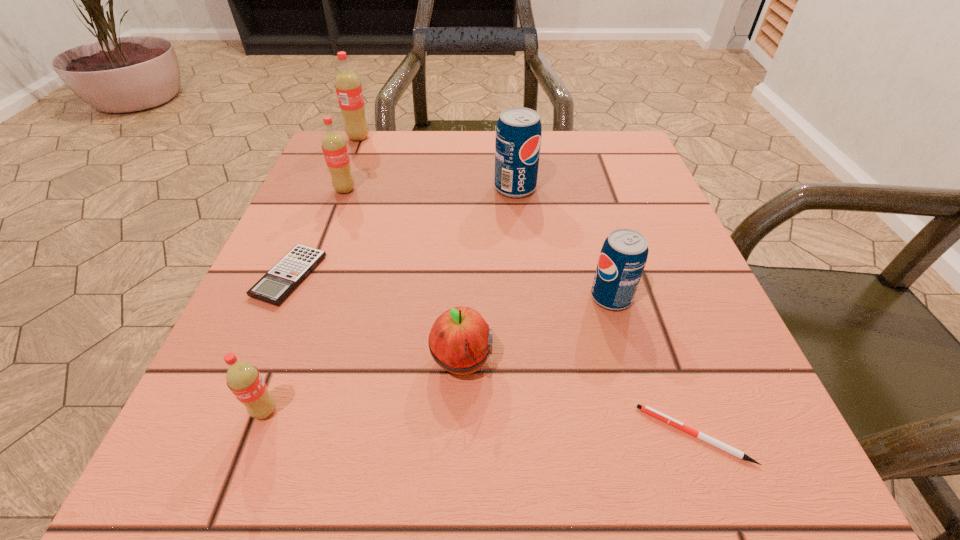
You are a GUI agent. You are given a task and a screenshot of the screen. Output one action in this format:
    pyautogui.click(x=<x>, y=<y>)
    Task: Click on the free space at the near edge of the desktop
    The image size is (960, 540).
    Given the screenshot: What is the action you would take?
    pyautogui.click(x=371, y=465)

Identify the location of vacant space at the left edge of the desktop. The image size is (960, 540). (289, 349).

Identify the location of free space at the right edge. 699,360.

At what (x,y) coordinates should I click in order to perform the action: click on vacant space at the far left corner of the desktop. Please return your answer as a coordinate pair (x, y). The image size is (960, 540). Looking at the image, I should click on [x=349, y=151].

Image resolution: width=960 pixels, height=540 pixels. In the image, there is a desktop. Identify the location of free space at the near left corner. (271, 502).

Find the location of a particular element. The image size is (960, 540). free region at the far right corner of the desktop is located at coordinates (592, 163).

The image size is (960, 540). I want to click on unoccupied area between the calculator and the third shortest object, so click(x=375, y=319).

Locate an element on the screen. free space between the rightmost soda and the second farthest red soda is located at coordinates (478, 244).

This screenshot has height=540, width=960. Find the location of `free space between the nearer blue pop and the apple`. free space between the nearer blue pop and the apple is located at coordinates (537, 329).

The image size is (960, 540). I want to click on vacant point located between the right blue pop and the fifth object from left to right, so 537,329.